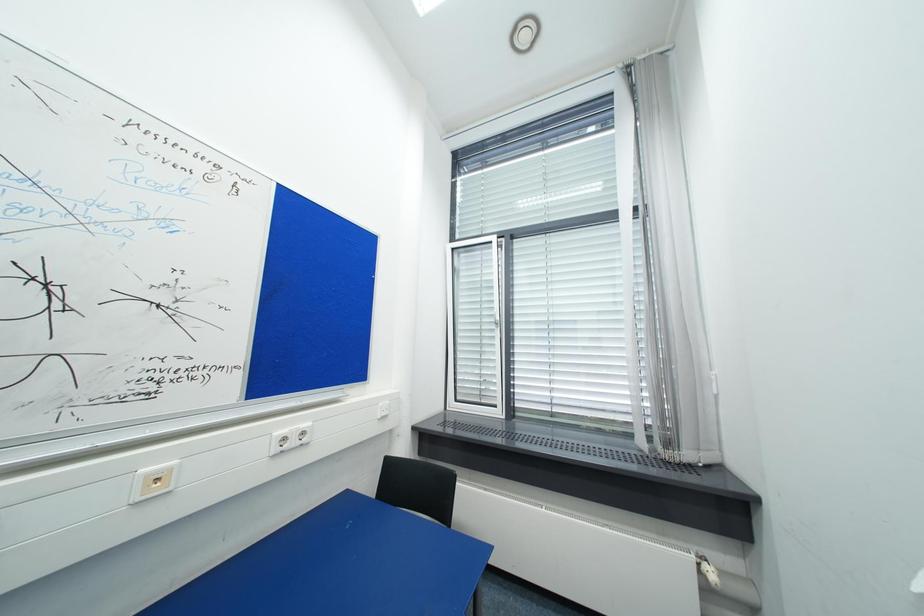
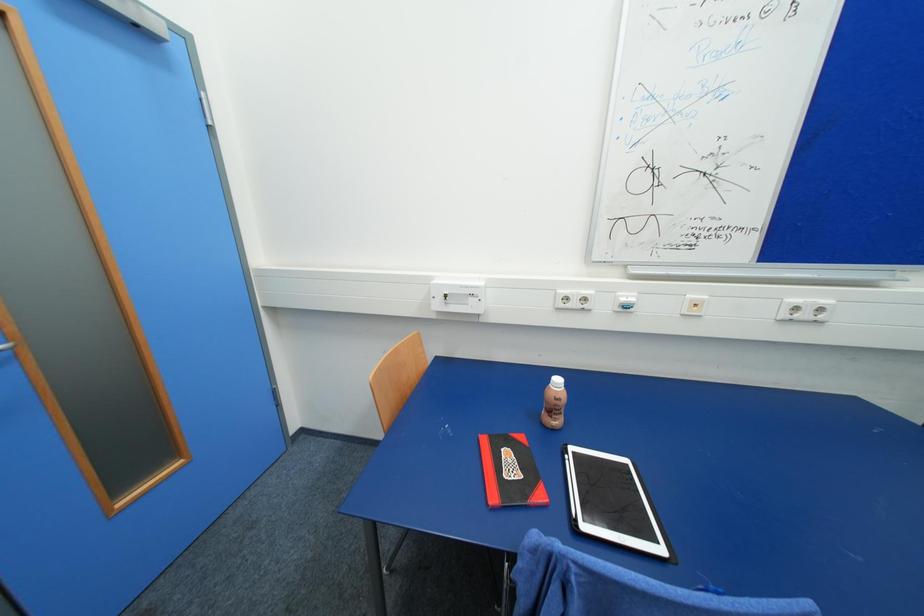
The images are taken continuously from a first-person perspective. In which direction is your viewpoint rotating?

The camera rotated toward left-down.